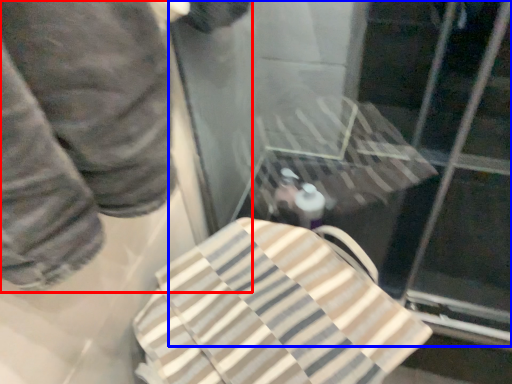
Question: Which of the following is the closest to the observer, person (highlighted by a red box) or glass door (highlighted by a blue box)?

Choices:
 (A) person
 (B) glass door

Answer: (A)